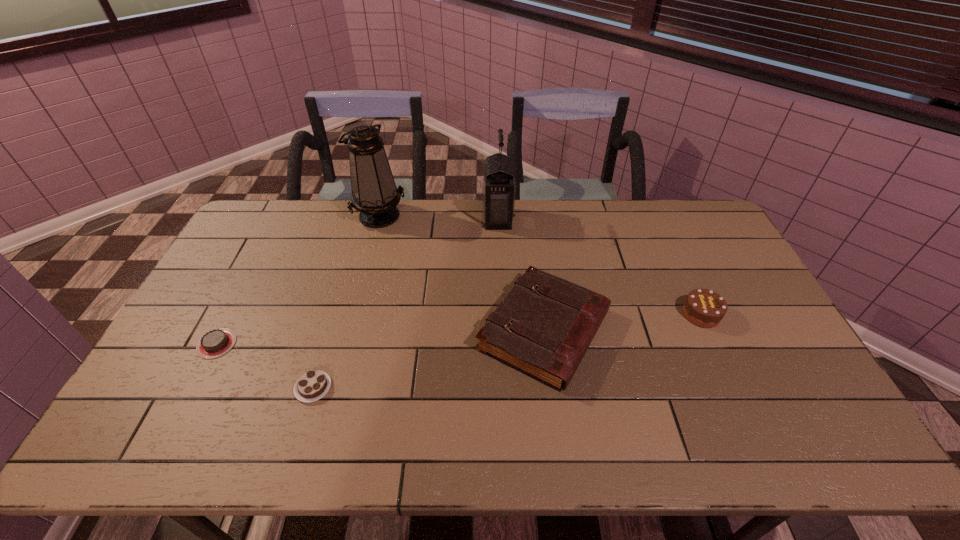
Find the location of `free point between the lantern and the leftmost chocolate cake`. free point between the lantern and the leftmost chocolate cake is located at coordinates (357, 281).

This screenshot has height=540, width=960. Find the location of `vacant area that lies between the oil lamp and the nearest chocolate cake`. vacant area that lies between the oil lamp and the nearest chocolate cake is located at coordinates (347, 301).

The width and height of the screenshot is (960, 540). In order to click on vacant area that lies between the lantern and the hardback book in this screenshot , I will do `click(521, 275)`.

Choose which object is the nearest neighbor to the tallest chocolate cake. Please provide its 2D coordinates. Your answer should be formatted as a tuple, i.e. [(x, y)], where the tuple contains the x and y coordinates of a point satisfying the conditions above.

[(544, 326)]

Select which object is the third closest to the lantern. Please provide its 2D coordinates. Your answer should be formatted as a tuple, i.e. [(x, y)], where the tuple contains the x and y coordinates of a point satisfying the conditions above.

[(704, 308)]

Where is `chocolate cake object that ranks as the third closest to the oil lamp`? The image size is (960, 540). chocolate cake object that ranks as the third closest to the oil lamp is located at coordinates (704, 308).

Find the location of a particular element. The width and height of the screenshot is (960, 540). the closest chocolate cake to the nearest chocolate cake is located at coordinates (215, 343).

The height and width of the screenshot is (540, 960). I want to click on vacant area that satisfies the following two spatial constraints: 1. on the front-facing side of the hardback book; 2. on the left side of the lantern, so click(x=503, y=330).

The height and width of the screenshot is (540, 960). Find the location of `free space that satisfies the following two spatial constraints: 1. on the front-facing side of the lantern; 2. on the front side of the second nearest chocolate cake`. free space that satisfies the following two spatial constraints: 1. on the front-facing side of the lantern; 2. on the front side of the second nearest chocolate cake is located at coordinates (504, 344).

This screenshot has height=540, width=960. Find the location of `free spot that satisfies the following two spatial constraints: 1. on the front-facing side of the rightmost chocolate cake; 2. on the right side of the lantern`. free spot that satisfies the following two spatial constraints: 1. on the front-facing side of the rightmost chocolate cake; 2. on the right side of the lantern is located at coordinates (502, 314).